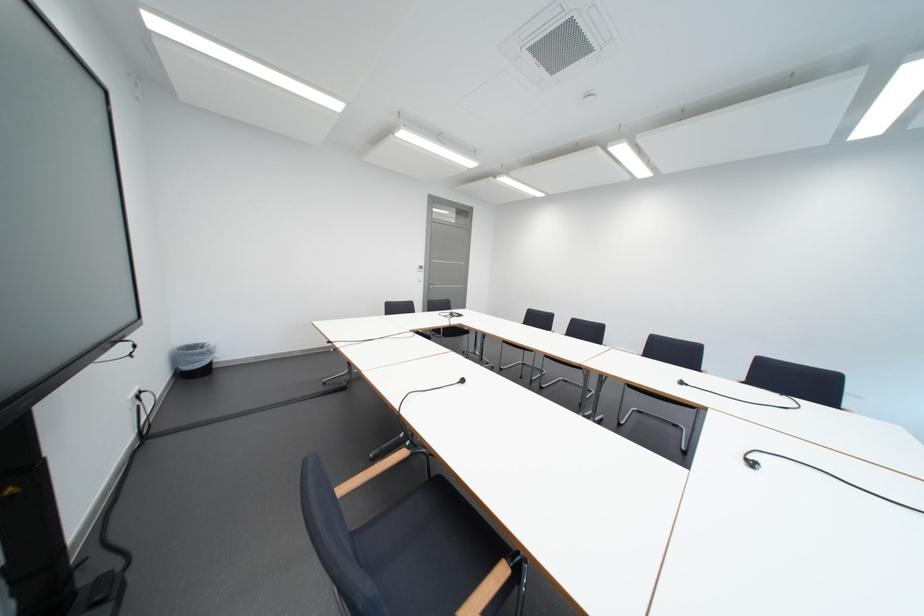
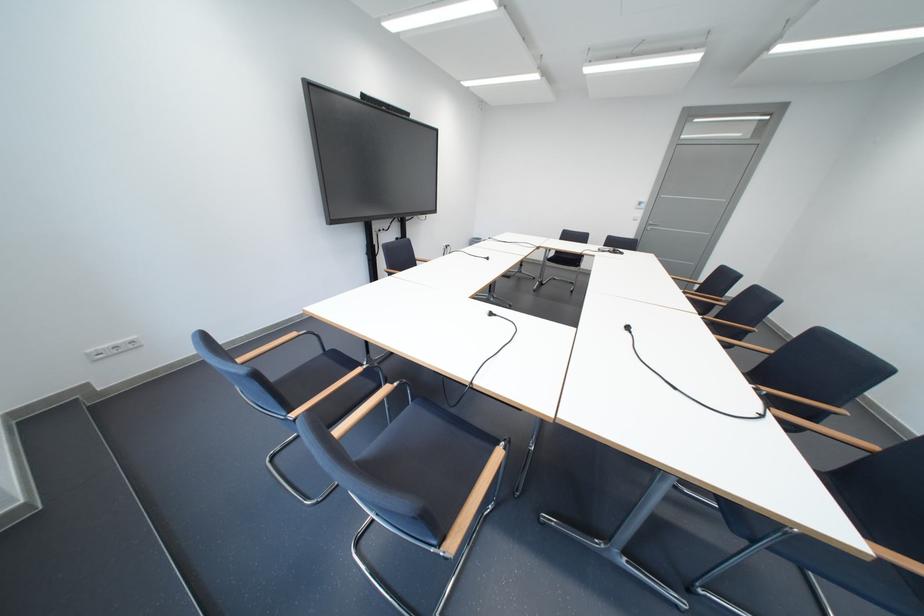
The point at (764, 466) is marked in the first image. Where is the corresponding point in the second image?

(503, 315)